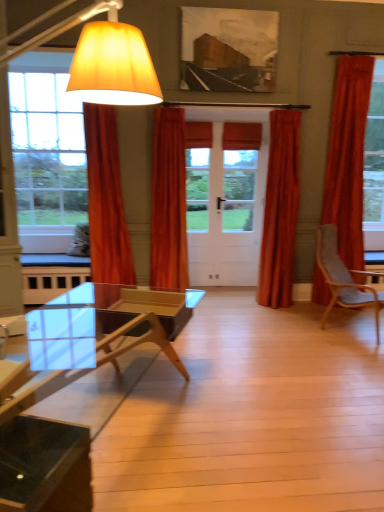
Question: Relative to transparent glass coffee table at lower left, is satin orange curtain at center, positioned as the 2th curtain in right-to-left order, in front or behind?

Choices:
 (A) front
 (B) behind

Answer: (B)

Question: From a real-world perspective, is satin orange curtain at center, the third curtain when ordered from left to right, positioned above or below transparent glass coffee table at lower left?

Choices:
 (A) above
 (B) below

Answer: (A)

Question: Based on their relative distances, which object is farther from the matte yellow fabric lampshade at left?

Choices:
 (A) transparent glass coffee table at lower left
 (B) velvet orange curtain at left, the 4th curtain viewed from the right
 (C) matte canvas picture frame at upper center
 (D) gray fabric chair at right
 (E) orange velvet curtain at center, which ranks as the second curtain in left-to-right order

Answer: (D)

Question: Estimate the real-world distances between objects in this image. Which object is farther from the velvet orange curtain at right, placed as the 1th curtain when sorted from right to left?

Choices:
 (A) matte yellow fabric lampshade at left
 (B) orange velvet curtain at center, which ranks as the second curtain in left-to-right order
 (C) transparent glass coffee table at lower left
 (D) satin orange curtain at center, the third curtain when ordered from left to right
 (E) velvet orange curtain at left, the 4th curtain viewed from the right

Answer: (A)